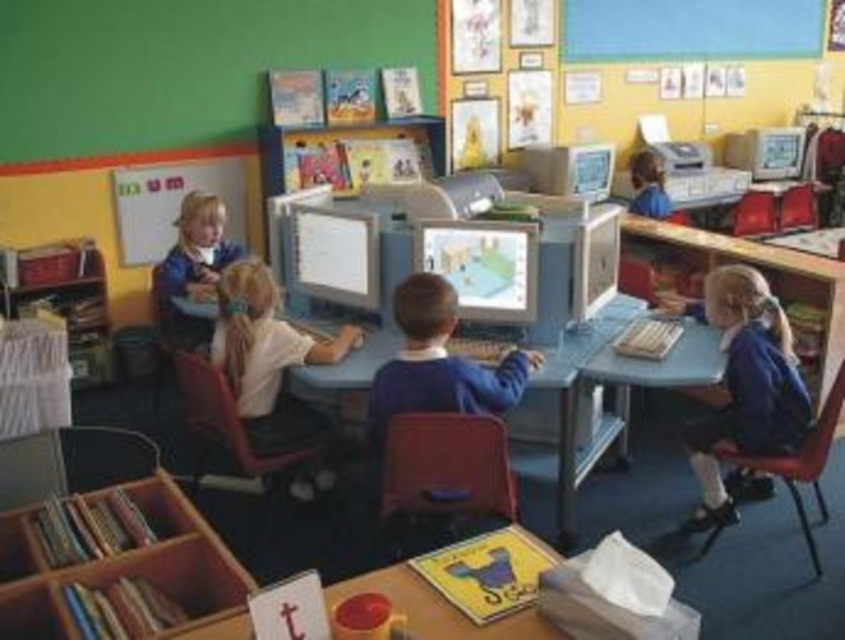
Question: Which is nearer to the blue fabric jacket at upper right?

Choices:
 (A) blue plastic table at center
 (B) white glossy monitor at center
 (C) wooden table at lower center
 (D) wooden bookshelf at lower left

Answer: (A)

Question: Is the position of white glossy shirt at center less distant than that of matte plastic monitor at center?

Choices:
 (A) yes
 (B) no

Answer: (A)

Question: Can you confirm if wooden bookshelf at lower left is positioned above matte plastic monitor at center?

Choices:
 (A) yes
 (B) no

Answer: (B)

Question: Among these objects, which one is farthest from the camera?

Choices:
 (A) white matte chalkboard at upper left
 (B) blue uniform at center
 (C) matte plastic monitor at center
 (D) blue fabric jacket at upper right

Answer: (D)

Question: Does blue uniform at center have a larger size compared to blue plastic table at center?

Choices:
 (A) no
 (B) yes

Answer: (A)

Question: Considering the real-world distances, which object is farthest from the wooden bookshelf at lower left?

Choices:
 (A) wooden table at lower center
 (B) white matte chalkboard at upper left
 (C) matte plastic monitor at center
 (D) blue plastic table at center

Answer: (B)